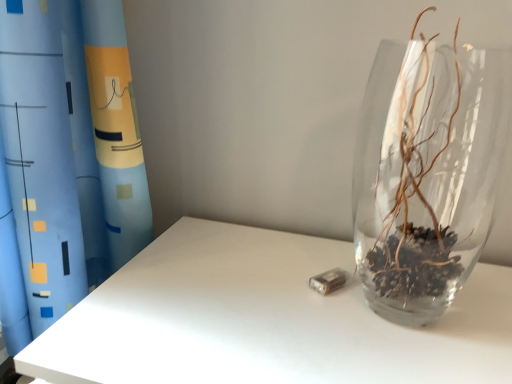
What do you see at coordinates (426, 173) in the screenshot?
I see `transparent glass vase at right` at bounding box center [426, 173].

Where is `transparent glass vase at right`? transparent glass vase at right is located at coordinates tap(426, 173).

Based on the photo, measure the distance between point (359, 160) and camera.

Point (359, 160) is 32.91 inches away from camera.

What is the approximate height of transparent glass vase at right?

transparent glass vase at right is 13.41 inches tall.

In order to face blue fabric curtain at upper left, should I rotate leftwards or rightwards?

Rotate your view left by about 24.759°.

Measure the distance between blue fabric curtain at upper left and camera.

A distance of 21.12 inches exists between blue fabric curtain at upper left and camera.

Describe the element at coordinates (39, 167) in the screenshot. I see `blue fabric curtain at upper left` at that location.

What are the coordinates of `blue fabric curtain at upper left` in the screenshot? It's located at (39, 167).

This screenshot has width=512, height=384. What are the coordinates of `transparent glass vase at right` in the screenshot? It's located at (426, 173).

Does transparent glass vase at right appear on the left side of blue fabric curtain at upper left?

No, transparent glass vase at right is not to the left of blue fabric curtain at upper left.

Does transparent glass vase at right come in front of blue fabric curtain at upper left?

No, the depth of transparent glass vase at right is greater than that of blue fabric curtain at upper left.

Is point (415, 161) closer or farther from the camera than point (17, 107)?

Clearly, point (415, 161) is more distant from the camera than point (17, 107).

From the image's perspective, between transparent glass vase at right and blue fabric curtain at upper left, who is located below?

transparent glass vase at right, from the image's perspective.

From a real-world perspective, is transparent glass vase at right physically located above or below blue fabric curtain at upper left?

Clearly, from a real-world perspective, transparent glass vase at right is above blue fabric curtain at upper left.

Can you confirm if transparent glass vase at right is thinner than blue fabric curtain at upper left?

Indeed, transparent glass vase at right has a lesser width compared to blue fabric curtain at upper left.

Between transparent glass vase at right and blue fabric curtain at upper left, which one has less height?

With less height is transparent glass vase at right.

Based on the photo, is transparent glass vase at right smaller than blue fabric curtain at upper left?

Yes, transparent glass vase at right is smaller than blue fabric curtain at upper left.

Is transparent glass vase at right spatially inside blue fabric curtain at upper left, or outside of it?

transparent glass vase at right is not inside blue fabric curtain at upper left, it's outside.

Does transparent glass vase at right touch blue fabric curtain at upper left?

transparent glass vase at right and blue fabric curtain at upper left are clearly separated.

Could you tell me if transparent glass vase at right is turned towards blue fabric curtain at upper left?

No, transparent glass vase at right is not aimed at blue fabric curtain at upper left.

Identify the location of curtain in front of the transparent glass vase at right. (39, 167).

Which object is positioned more to the right, blue fabric curtain at upper left or transparent glass vase at right?

transparent glass vase at right is more to the right.

Is the depth of blue fabric curtain at upper left greater than that of transparent glass vase at right?

No, the depth of blue fabric curtain at upper left is less than that of transparent glass vase at right.

Does point (4, 19) come behind point (410, 305)?

No, (4, 19) is in front of (410, 305).

From the image's perspective, between blue fabric curtain at upper left and transparent glass vase at right, which one is located above?

blue fabric curtain at upper left is shown above in the image.

From a real-world perspective, is blue fabric curtain at upper left physically below transparent glass vase at right?

Yes.

Which object is thinner, blue fabric curtain at upper left or transparent glass vase at right?

transparent glass vase at right.

Considering the sizes of objects blue fabric curtain at upper left and transparent glass vase at right in the image provided, who is shorter, blue fabric curtain at upper left or transparent glass vase at right?

transparent glass vase at right.

Is blue fabric curtain at upper left smaller than transparent glass vase at right?

Incorrect, blue fabric curtain at upper left is not smaller in size than transparent glass vase at right.

Does blue fabric curtain at upper left contain transparent glass vase at right?

That's incorrect, transparent glass vase at right is not inside blue fabric curtain at upper left.

Is blue fabric curtain at upper left placed right next to transparent glass vase at right?

No, blue fabric curtain at upper left is not making contact with transparent glass vase at right.

Is blue fabric curtain at upper left facing away from transparent glass vase at right?

No, blue fabric curtain at upper left is not facing away from transparent glass vase at right.

Measure the distance from blue fabric curtain at upper left to transparent glass vase at right.

blue fabric curtain at upper left and transparent glass vase at right are 22.00 inches apart.

This screenshot has width=512, height=384. Find the location of `curtain beneath the transparent glass vase at right (from a real-world perspective)`. curtain beneath the transparent glass vase at right (from a real-world perspective) is located at coordinates (39, 167).

Locate an element on the screen. The width and height of the screenshot is (512, 384). curtain above the transparent glass vase at right (from the image's perspective) is located at coordinates (39, 167).

There is a blue fabric curtain at upper left. At what (x,y) coordinates should I click in order to perform the action: click on vase above it (from a real-world perspective). Please return your answer as a coordinate pair (x, y). Image resolution: width=512 pixels, height=384 pixels. Looking at the image, I should click on (426, 173).